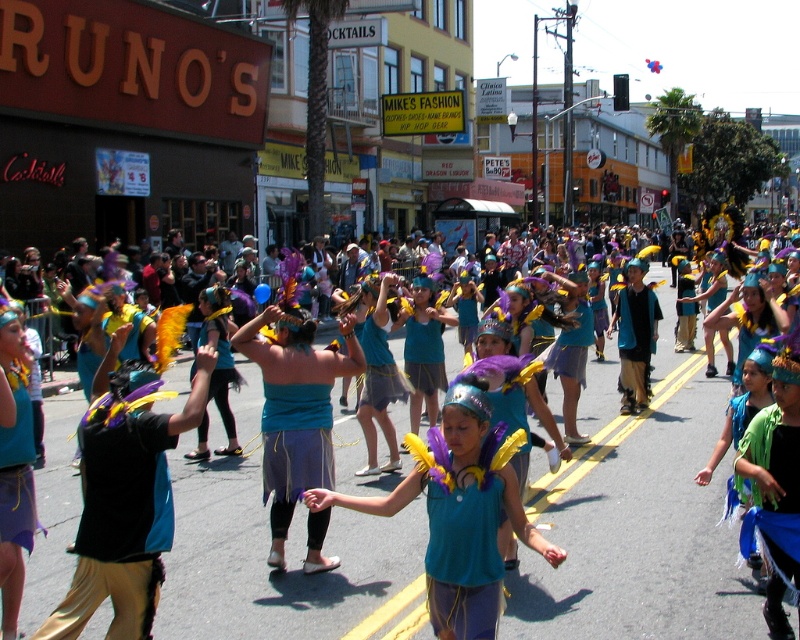
From the picture: Is matte black shirt at center to the right of teal fabric mask at center from the viewer's perspective?

In fact, matte black shirt at center is to the left of teal fabric mask at center.

Is matte black shirt at center below teal fabric mask at center?

Yes.

What do you see at coordinates (126, 499) in the screenshot? Image resolution: width=800 pixels, height=640 pixels. I see `matte black shirt at center` at bounding box center [126, 499].

Identify the location of matte black shirt at center. 126,499.

Does point (78, 616) come behind point (428, 461)?

Yes.

Does matte black shirt at center have a smaller size compared to matte teal tank top at center?

Correct, matte black shirt at center occupies less space than matte teal tank top at center.

Which is in front, point (54, 611) or point (430, 560)?

Point (430, 560)

In order to click on matte black shirt at center in this screenshot , I will do `click(126, 499)`.

Does matte teal tank top at center appear over teal fabric mask at center?

Incorrect, matte teal tank top at center is not positioned above teal fabric mask at center.

Based on the photo, is matte teal tank top at center to the right of teal fabric mask at center from the viewer's perspective?

In fact, matte teal tank top at center is to the left of teal fabric mask at center.

Between point (546, 541) and point (656, 333), which one is positioned behind?

Positioned behind is point (656, 333).

Find the location of a particular element. This screenshot has height=640, width=800. matte teal tank top at center is located at coordinates (458, 513).